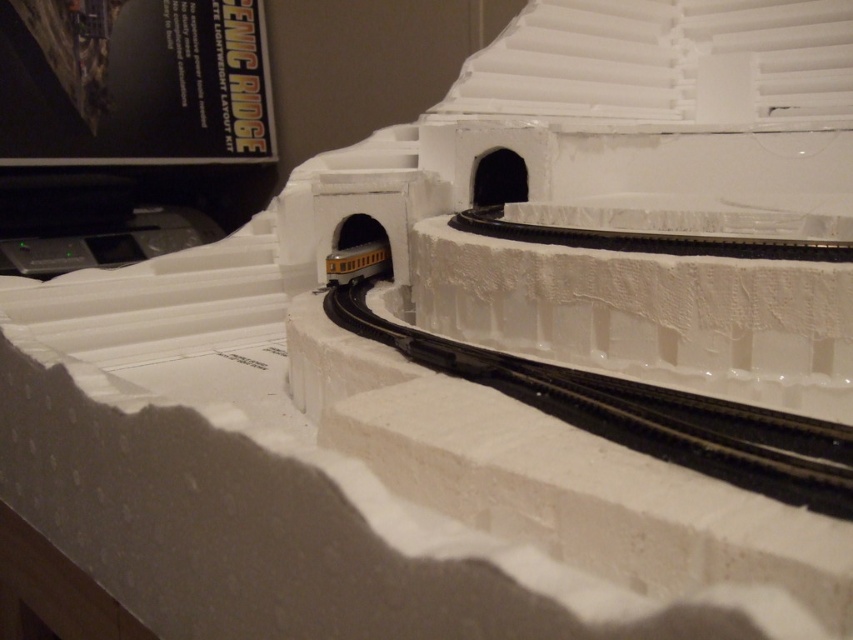
Does black rubber train track at center appear over yellow matte train at center?

No, black rubber train track at center is not above yellow matte train at center.

Describe the element at coordinates (640, 413) in the screenshot. I see `black rubber train track at center` at that location.

The height and width of the screenshot is (640, 853). What do you see at coordinates (640, 413) in the screenshot? I see `black rubber train track at center` at bounding box center [640, 413].

Locate an element on the screen. Image resolution: width=853 pixels, height=640 pixels. black rubber train track at center is located at coordinates pyautogui.click(x=640, y=413).